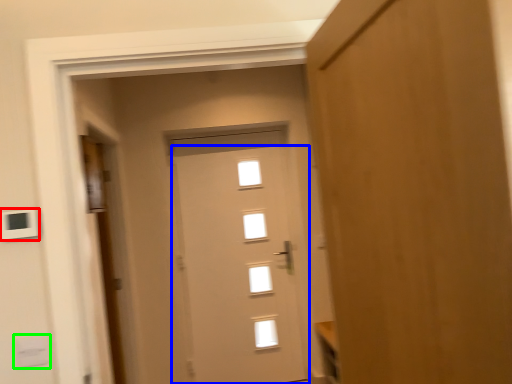
Question: Which object is the closest to the light switch (highlighted by a red box)? Choose among these: door (highlighted by a blue box) or light switch (highlighted by a green box).

Choices:
 (A) door
 (B) light switch

Answer: (B)